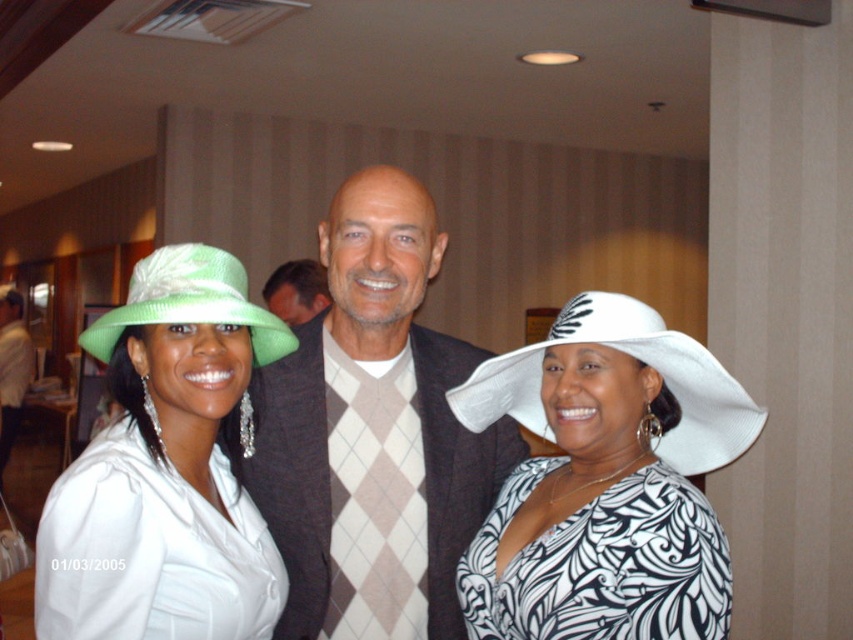
Is the position of matte green hat at left less distant than that of argyle sweater at center?

Yes, it is.

Does matte green hat at left have a greater width compared to argyle sweater at center?

Yes.

Who is more distant from viewer, (474,554) or (358,349)?

Positioned behind is point (358,349).

At what (x,y) coordinates should I click in order to perform the action: click on matte green hat at left. Please return your answer as a coordinate pair (x, y). Looking at the image, I should click on (438, 401).

Measure the distance between point (279, 477) and camera.

Point (279, 477) and camera are 1.56 meters apart.

Can you confirm if matte green hat at left is thinner than white printed dress at center?

In fact, matte green hat at left might be wider than white printed dress at center.

Between point (683, 458) and point (624, 394), which one is positioned behind?

The point (683, 458) is more distant.

Identify the location of matte green hat at left. The image size is (853, 640). (438, 401).

Is point (346, 500) farther from camera compared to point (726, 404)?

Yes, it is behind point (726, 404).

Is argyle sweater at center behind white printed dress at center?

Yes, argyle sweater at center is behind white printed dress at center.

Does point (346, 259) lie behind point (624, 312)?

Yes, it is behind point (624, 312).

This screenshot has width=853, height=640. In order to click on argyle sweater at center in this screenshot , I will do `click(373, 433)`.